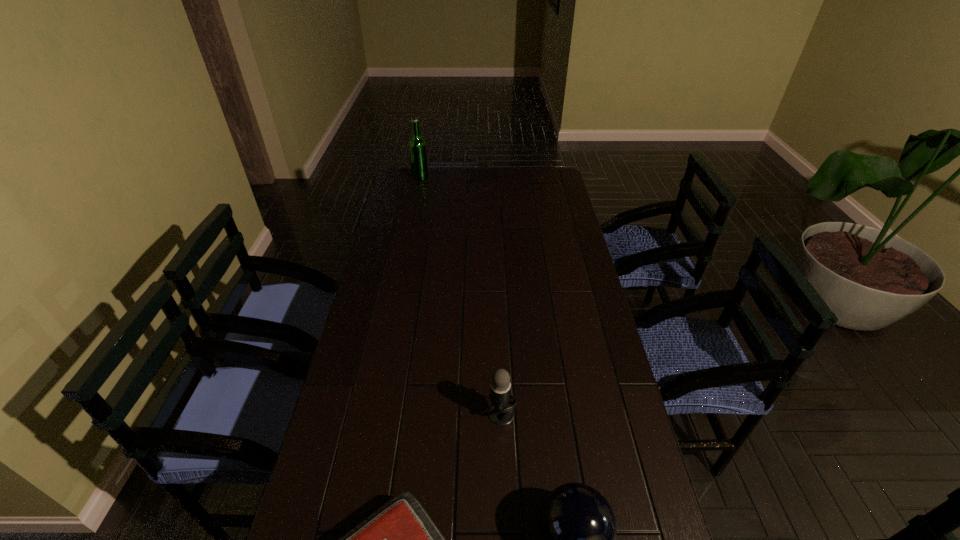
Locate an element on the screen. the tallest object is located at coordinates (418, 155).

The image size is (960, 540). I want to click on the farthest object, so click(x=418, y=155).

I want to click on the third nearest object, so click(501, 412).

Where is `the third object from left to right`? the third object from left to right is located at coordinates (501, 412).

Find the location of `free space located 0.400m on the right of the farthest object`. free space located 0.400m on the right of the farthest object is located at coordinates (511, 177).

Image resolution: width=960 pixels, height=540 pixels. What are the coordinates of `vacant area situated 0.310m on the left of the third nearest object` in the screenshot? It's located at (371, 414).

Locate an element on the screen. object positioned at the far edge is located at coordinates (418, 155).

Image resolution: width=960 pixels, height=540 pixels. I want to click on object that is at the left edge, so click(x=418, y=155).

The height and width of the screenshot is (540, 960). In order to click on object present at the far left corner in this screenshot , I will do `click(418, 155)`.

I want to click on free space at the left edge of the desktop, so (x=407, y=262).